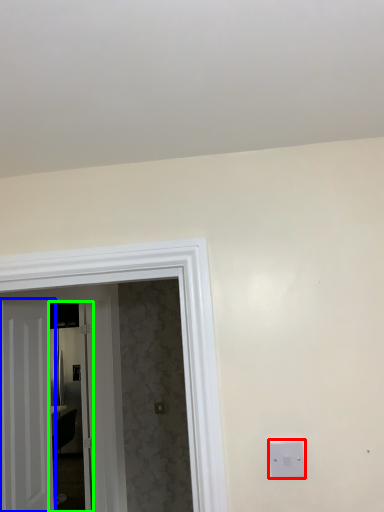
Question: Which object is the farthest from light switch (highlighted by a red box)? Choose among these: door (highlighted by a blue box) or glass door (highlighted by a green box).

Choices:
 (A) door
 (B) glass door

Answer: (B)